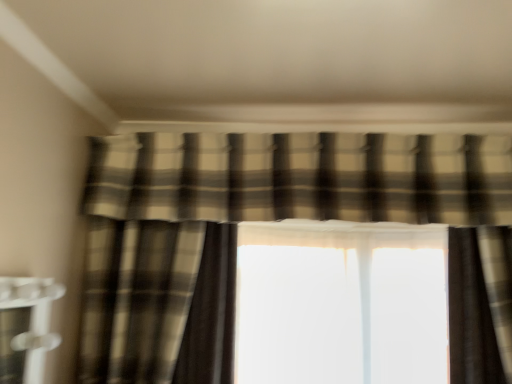
The height and width of the screenshot is (384, 512). In order to click on white sheer curtain at center in this screenshot , I will do `click(341, 303)`.

Image resolution: width=512 pixels, height=384 pixels. Describe the element at coordinates (341, 303) in the screenshot. I see `white sheer curtain at center` at that location.

Locate an element on the screen. Image resolution: width=512 pixels, height=384 pixels. white sheer curtain at center is located at coordinates (341, 303).